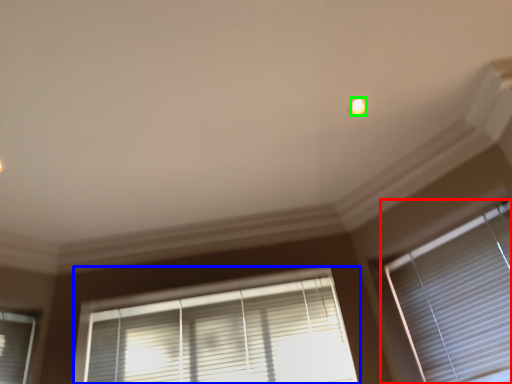
Question: Based on their relative distances, which object is farther from window blind (highlighted by a red box)? Choose from window blind (highlighted by a blue box) and light (highlighted by a green box).

Choices:
 (A) window blind
 (B) light

Answer: (B)